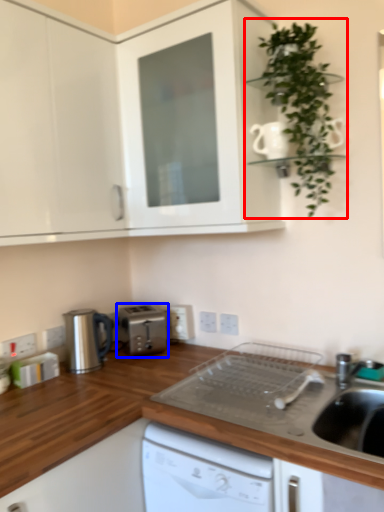
Question: Which point is closer to the camera, houseplant (highlighted by a red box) or kitchen appliance (highlighted by a blue box)?

Choices:
 (A) houseplant
 (B) kitchen appliance

Answer: (A)